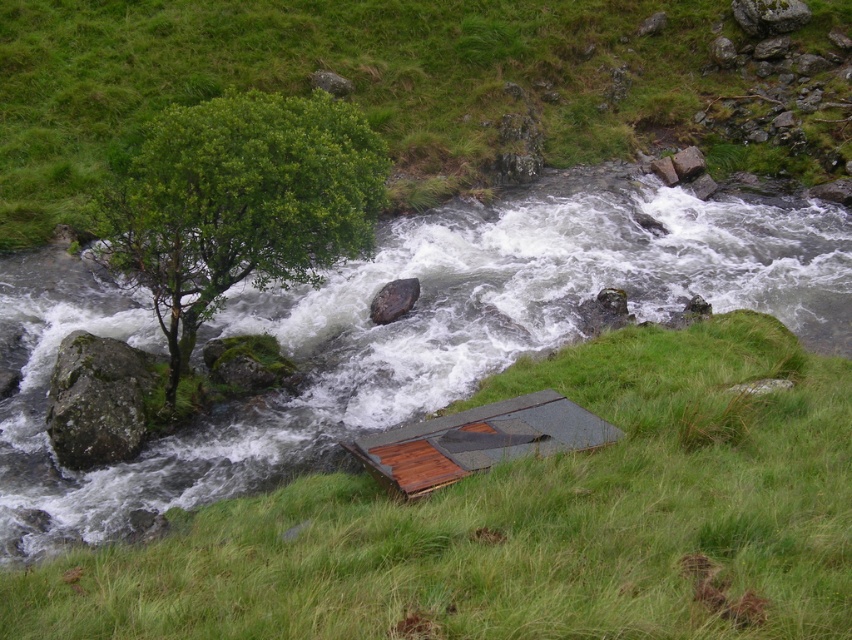
Question: Does green grassy at lower center appear on the right side of green leafy tree at upper left?

Choices:
 (A) yes
 (B) no

Answer: (A)

Question: Which of the following is the farthest from the observer?

Choices:
 (A) gray/wooden hut at lower center
 (B) green grassy at lower center
 (C) gray rock at upper center

Answer: (C)

Question: Is green leafy tree at upper left thinner than gray rock at upper center?

Choices:
 (A) yes
 (B) no

Answer: (B)

Question: Among these objects, which one is nearest to the camera?

Choices:
 (A) green grassy at lower center
 (B) green leafy tree at upper left
 (C) brown rough rock at center
 (D) green mossy rock at left

Answer: (A)

Question: Can you confirm if green mossy rock at left is smaller than gray rock at upper right?

Choices:
 (A) yes
 (B) no

Answer: (B)

Question: Which point appears closest to the camera in this image?

Choices:
 (A) (602, 627)
 (B) (96, 392)

Answer: (A)